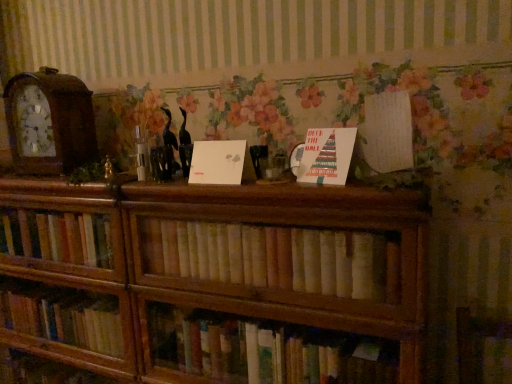
Question: Is there a large distance between white paper at center, which ranks as the 2th paperback book in left-to-right order, and wooden clock at left?

Choices:
 (A) yes
 (B) no

Answer: (B)

Question: Is wooden clock at left at the back of white paper at center, which ranks as the 2th paperback book in left-to-right order?

Choices:
 (A) yes
 (B) no

Answer: (B)

Question: Could you tell me if white paper at center, positioned as the 2th paperback book in right-to-left order, is facing wooden clock at left?

Choices:
 (A) yes
 (B) no

Answer: (B)

Question: Is white paper at center, which ranks as the 2th paperback book in left-to-right order, located outside wooden clock at left?

Choices:
 (A) no
 (B) yes

Answer: (B)

Question: Considering the relative positions of white paper at center, positioned as the 2th paperback book in right-to-left order, and wooden clock at left in the image provided, is white paper at center, positioned as the 2th paperback book in right-to-left order, to the left of wooden clock at left from the viewer's perspective?

Choices:
 (A) no
 (B) yes

Answer: (A)

Question: In the image, is light brown wooden bookshelf at center on the left side or the right side of white paper at center, the third paperback book when ordered from right to left?

Choices:
 (A) right
 (B) left

Answer: (A)

Question: From a real-world perspective, is light brown wooden bookshelf at center positioned above or below white paper at center, the third paperback book when ordered from right to left?

Choices:
 (A) above
 (B) below

Answer: (B)

Question: In terms of height, does light brown wooden bookshelf at center look taller or shorter compared to white paper at center, the third paperback book when ordered from right to left?

Choices:
 (A) short
 (B) tall

Answer: (B)

Question: Is point (314, 228) closer or farther from the camera than point (237, 178)?

Choices:
 (A) farther
 (B) closer

Answer: (B)

Question: Would you say wooden bookcase at center is to the left or to the right of white paper at center, positioned as the first paperback book in left-to-right order, in the picture?

Choices:
 (A) left
 (B) right

Answer: (A)

Question: From a real-world perspective, is wooden bookcase at center physically located above or below white paper at center, the third paperback book when ordered from right to left?

Choices:
 (A) below
 (B) above

Answer: (A)

Question: From the image's perspective, relative to white paper at center, positioned as the first paperback book in left-to-right order, is wooden bookcase at center above or below?

Choices:
 (A) above
 (B) below

Answer: (B)

Question: Based on their sizes in the image, would you say wooden bookcase at center is bigger or smaller than white paper at center, the third paperback book when ordered from right to left?

Choices:
 (A) big
 (B) small

Answer: (A)

Question: In the image, is white paper at center, the third paperback book when ordered from right to left, positioned in front of or behind wooden clock at left?

Choices:
 (A) behind
 (B) front

Answer: (B)

Question: Would you say white paper at center, positioned as the first paperback book in left-to-right order, is inside or outside wooden clock at left?

Choices:
 (A) outside
 (B) inside

Answer: (A)